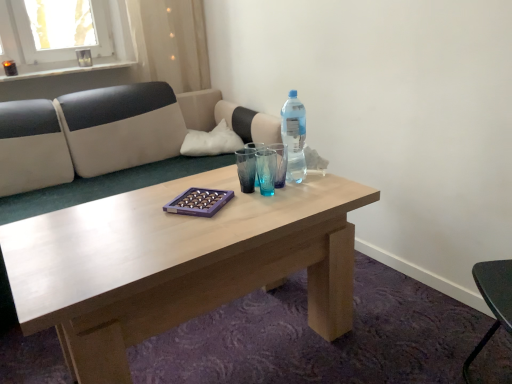
You are a GUI agent. You are given a task and a screenshot of the screen. Output one action in this format:
    pyautogui.click(x=<x>, y=<y>)
    Task: Click on the vacant area that is situated to the right of transparent glass vase at upper left
    This screenshot has height=384, width=512.
    Given the screenshot: What is the action you would take?
    pyautogui.click(x=104, y=61)